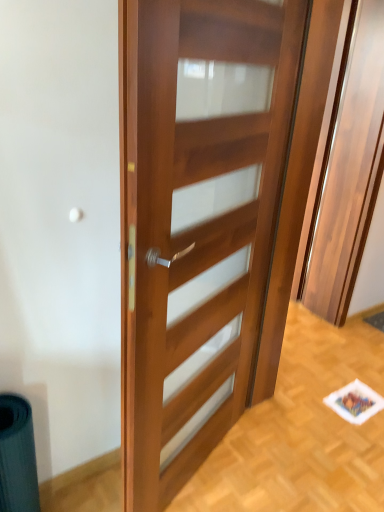
You are a GUI agent. You are given a task and a screenshot of the screen. Output one action in this format:
    pyautogui.click(x=<x>, y=<y>)
    Task: Click on the vacant space underneath wooden door at center (from a real-world perspective)
    This screenshot has width=384, height=512.
    Given the screenshot: What is the action you would take?
    pyautogui.click(x=215, y=462)